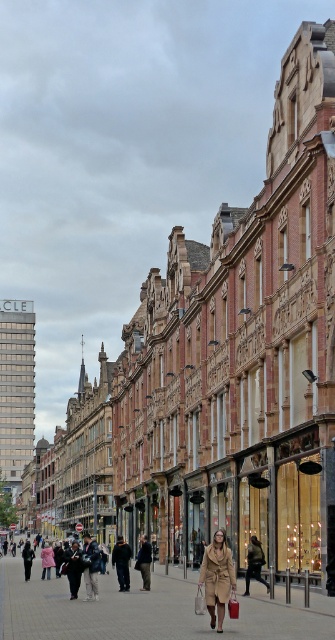
Question: Can you confirm if camel wool coat at center is positioned to the right of matte beige shopping bag at center?

Choices:
 (A) no
 (B) yes

Answer: (B)

Question: Does brick pavement at center have a smaller size compared to camel wool coat at center?

Choices:
 (A) yes
 (B) no

Answer: (B)

Question: Estimate the real-world distances between objects in this image. Which object is farther from the brick pavement at center?

Choices:
 (A) matte beige shopping bag at center
 (B) camel wool coat at center

Answer: (B)

Question: Which object is positioned farthest from the brick pavement at center?

Choices:
 (A) camel wool coat at center
 (B) matte beige shopping bag at center

Answer: (A)

Question: Which of the following is the farthest from the observer?

Choices:
 (A) camel wool coat at center
 (B) matte beige shopping bag at center
 (C) brick pavement at center

Answer: (B)

Question: Can you confirm if brick pavement at center is bigger than camel wool coat at center?

Choices:
 (A) yes
 (B) no

Answer: (A)